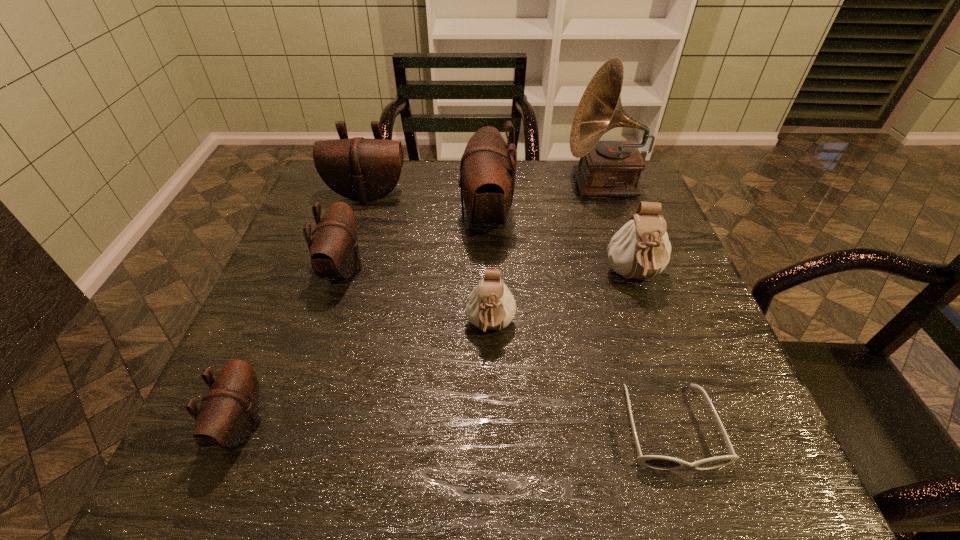
Identify the location of the nearest brown pouch. (229, 409).

Identify the location of the smallest brown pouch. (229, 409).

Locate an element on the screen. the shortest object is located at coordinates (657, 462).

The width and height of the screenshot is (960, 540). I want to click on sunglasses, so click(x=657, y=462).

The width and height of the screenshot is (960, 540). I want to click on vacant point located on the horn of the tallest object, so click(491, 184).

Where is `free region located 0.070m on the horn of the tallest object`? free region located 0.070m on the horn of the tallest object is located at coordinates (541, 184).

Locate an element on the screen. This screenshot has height=540, width=960. free space located 0.260m on the horn of the tallest object is located at coordinates (477, 184).

Identify the location of free space located with the flap open on the seventh shortest object. The image size is (960, 540). (318, 217).

At what (x,y) coordinates should I click in order to perform the action: click on vacant region located 0.120m with the flap open on the seventh shortest object. Please return your answer as a coordinate pair (x, y). This screenshot has height=540, width=960. Looking at the image, I should click on (415, 217).

At what (x,y) coordinates should I click in order to perform the action: click on free space located 0.250m with the flap open on the seventh shortest object. Please return your answer as a coordinate pair (x, y). Image resolution: width=960 pixels, height=540 pixels. Looking at the image, I should click on (366, 217).